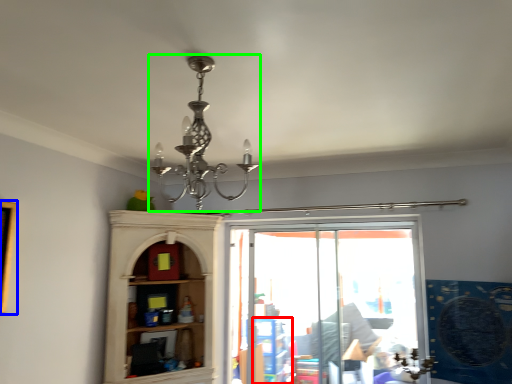
Question: Estimate the real-world distances between objects in this image. Which object is farther from shelf (highlighted by a red box), picture frame (highlighted by a blue box) or lamp (highlighted by a green box)?

Choices:
 (A) picture frame
 (B) lamp

Answer: (B)